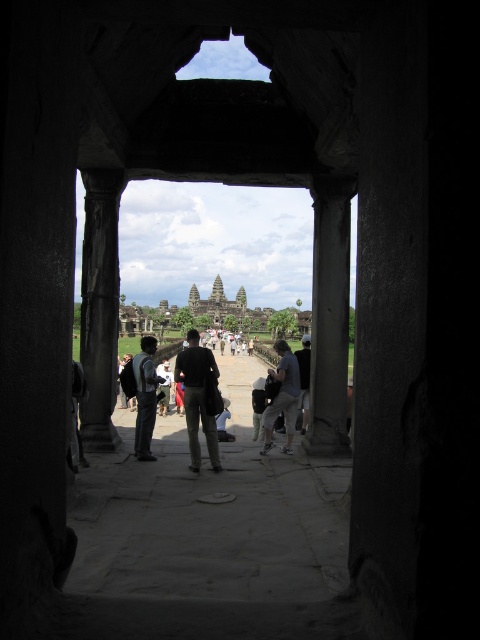
Question: Which is farther from the dark gray backpack at center?

Choices:
 (A) dark gray stone pillar at left
 (B) dark gray jacket at center
 (C) dark gray stone pillar at center
 (D) stone temple at center

Answer: (D)

Question: Where is dark green uniform at center located in relation to dark gray backpack at center in the image?

Choices:
 (A) right
 (B) left

Answer: (A)

Question: Which point appears farthest from the camera in this image?

Choices:
 (A) (180, 358)
 (B) (280, 356)

Answer: (B)

Question: Which of the following is the closest to the observer?

Choices:
 (A) (146, 381)
 (B) (332, 234)
 (C) (116, 385)

Answer: (B)

Question: Does light gray fabric pants at center appear under dark gray backpack at center?

Choices:
 (A) yes
 (B) no

Answer: (A)

Question: Is dark gray stone pillar at center thinner than stone temple at center?

Choices:
 (A) no
 (B) yes

Answer: (B)